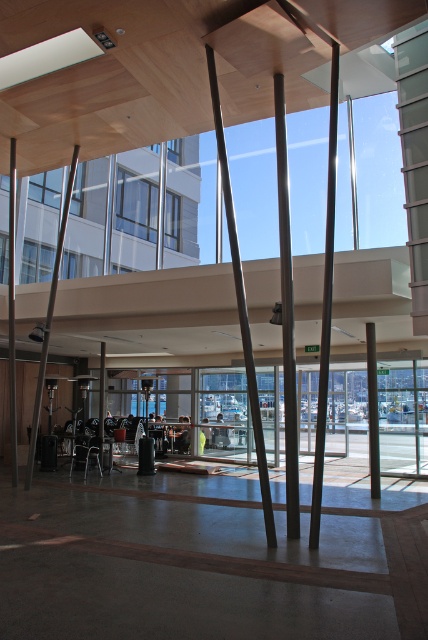
Between polished metal pole at center and smooth gray pole at center, which one appears on the right side from the viewer's perspective?

Positioned to the right is smooth gray pole at center.

Can you confirm if polished metal pole at center is shorter than smooth gray pole at center?

In fact, polished metal pole at center may be taller than smooth gray pole at center.

Does point (293, 493) come behind point (368, 448)?

No, it is not.

You are a GUI agent. You are given a task and a screenshot of the screen. Output one action in this format:
    pyautogui.click(x=<x>, y=<y>)
    Task: Click on the polished metal pole at center
    
    Given the screenshot: What is the action you would take?
    pyautogui.click(x=287, y=316)